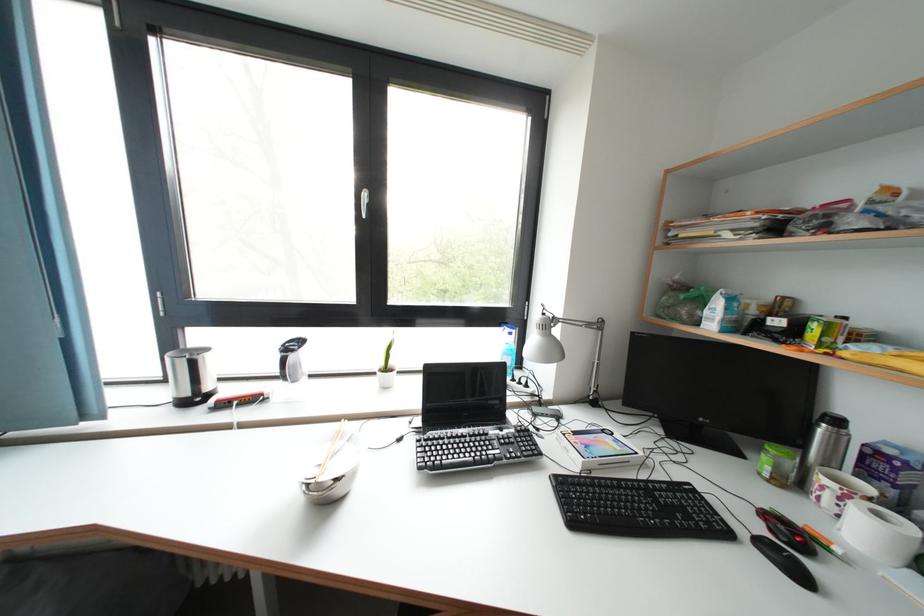
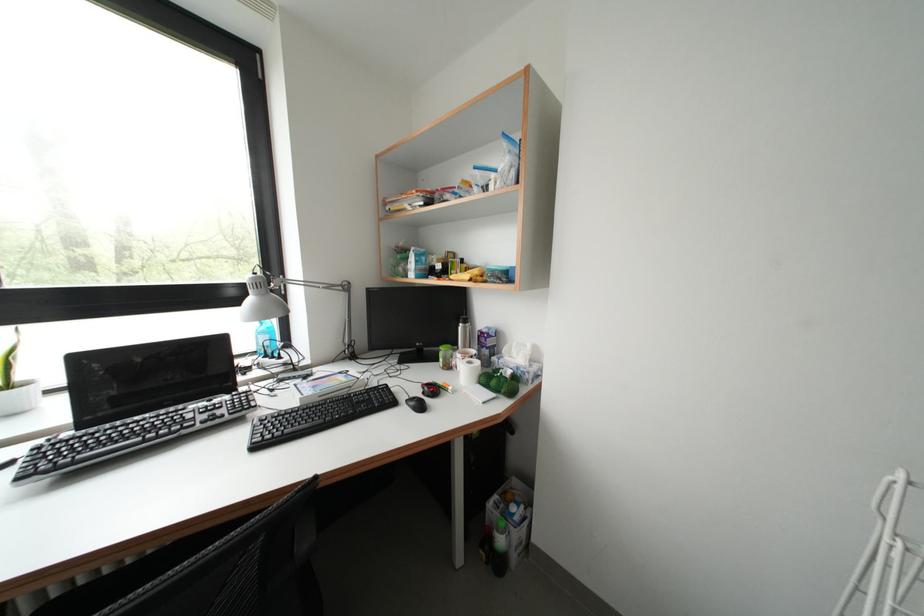
The point at (877, 504) is marked in the first image. Where is the corresponding point in the second image?

(479, 362)